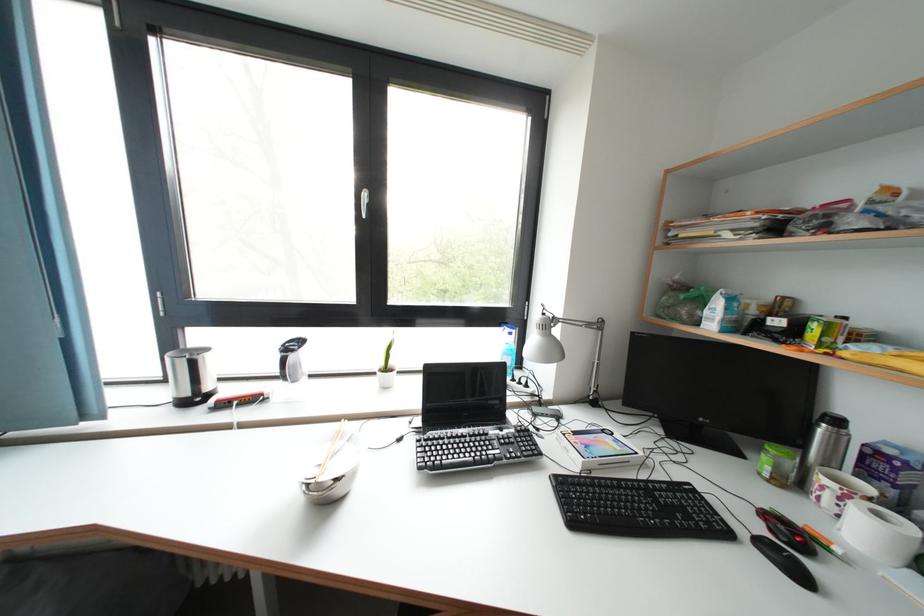
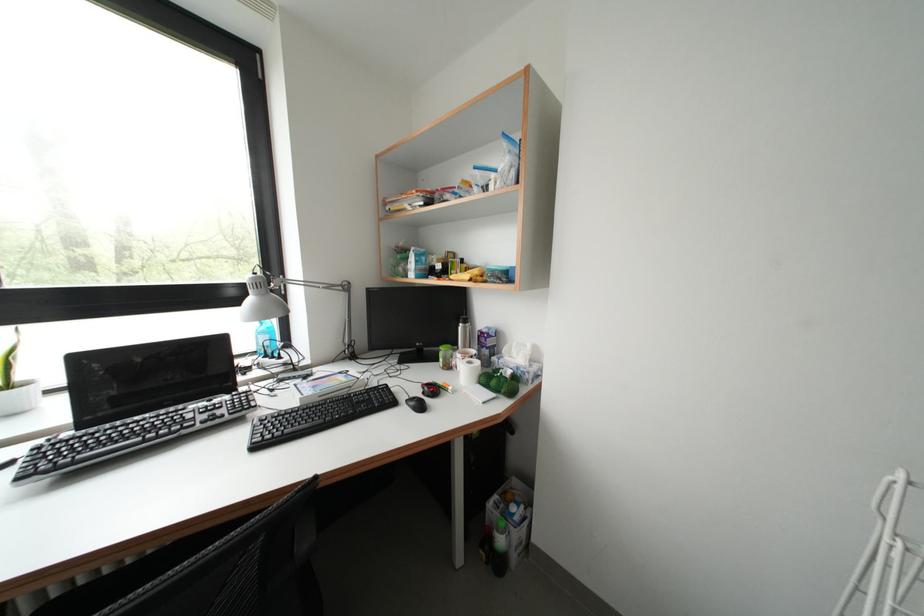
The point at (877, 504) is marked in the first image. Where is the corresponding point in the second image?

(479, 362)